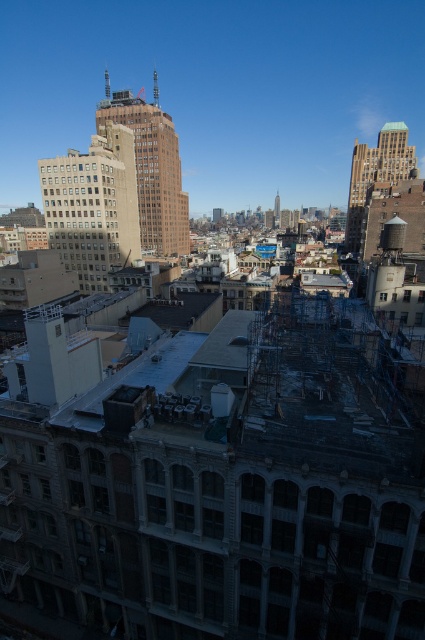
You are standing at the center of the image and looking towards the point marked at coordinates (x=152, y=168). Which building are you facing?

The point at coordinates (x=152, y=168) is located on the brown brick building at upper center, so you are facing the brown brick building at upper center.

You are standing on the observation deck of the nearest building. You see the exposed concrete scaffolding at center and the matte glass building at center. Which one is closer to you?

The exposed concrete scaffolding at center is closer to you than the matte glass building at center because it is only 231.06 feet away from the matte glass building at center.